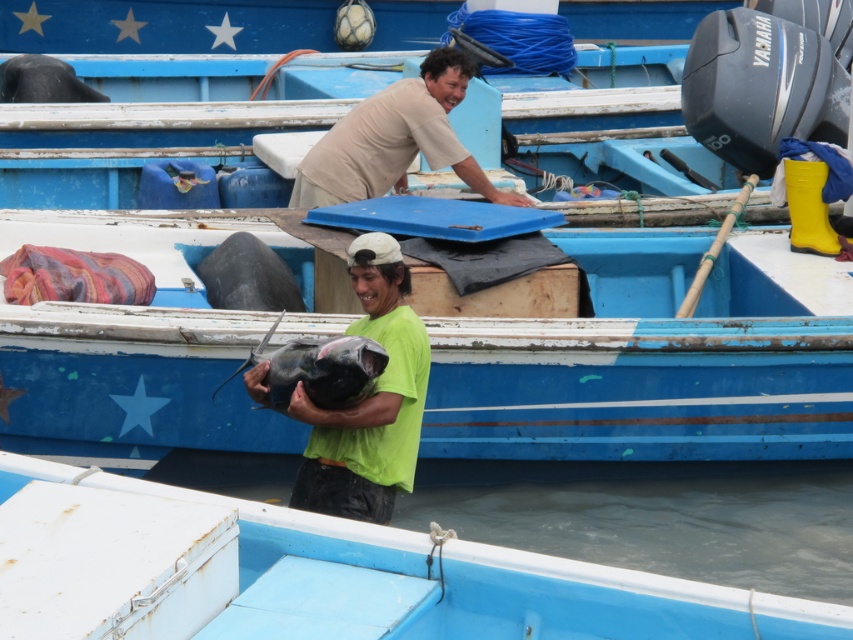
Question: Which object appears closest to the camera in this image?

Choices:
 (A) shiny dark gray fish at center
 (B) clear water at lower center
 (C) blue matte boat at lower center
 (D) light brown cotton shirt at upper center

Answer: (C)

Question: Does blue painted wood boat at center have a smaller size compared to light brown cotton shirt at upper center?

Choices:
 (A) yes
 (B) no

Answer: (B)

Question: Can you confirm if light brown cotton shirt at upper center is positioned to the left of dark gray matte fish at center?

Choices:
 (A) yes
 (B) no

Answer: (B)

Question: Which object is farther from the camera taking this photo?

Choices:
 (A) blue matte boat at lower center
 (B) shiny dark gray fish at center

Answer: (B)

Question: Is green matte shirt at center to the right of light brown cotton shirt at upper center from the viewer's perspective?

Choices:
 (A) no
 (B) yes

Answer: (A)

Question: Estimate the real-world distances between objects in this image. Which object is closer to the green matte shirt at center?

Choices:
 (A) light brown cotton shirt at upper center
 (B) shiny dark gray fish at center
 (C) blue matte boat at lower center

Answer: (B)